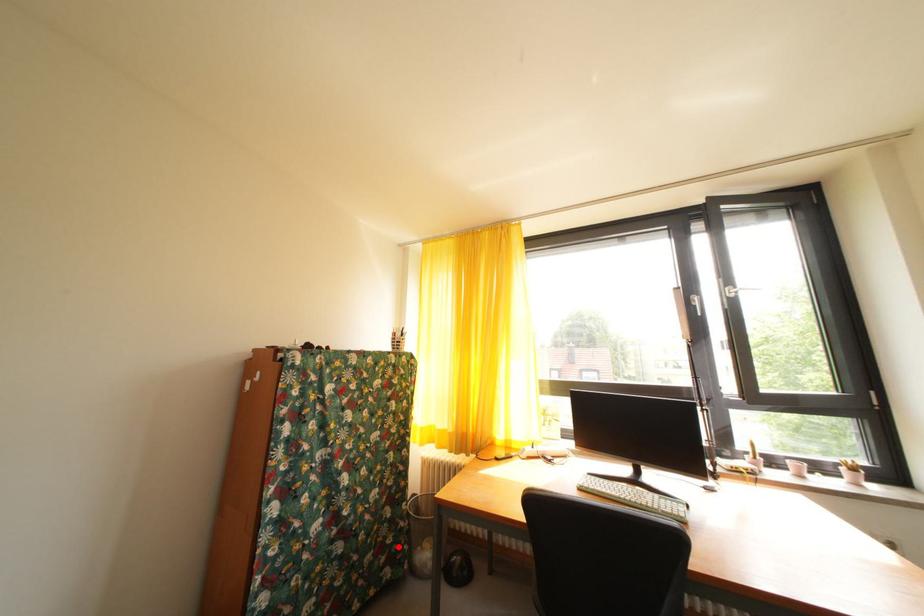
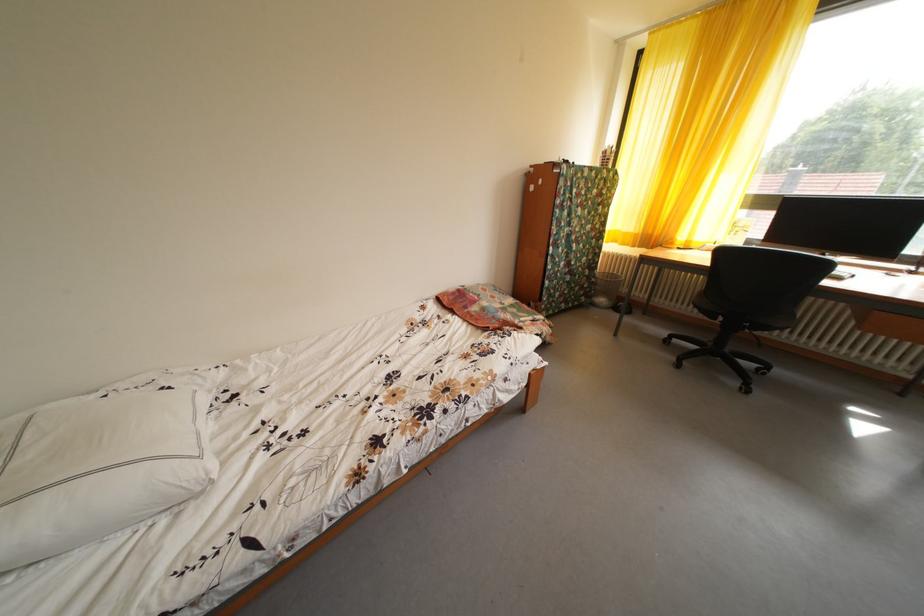
Question: I am providing you with two images of the same scene from different viewpoints. A red point is shown in image1. For the corresponding object point in image2, is it positioned nearer or farther from the camera?

Choices:
 (A) Nearer
 (B) Farther

Answer: (A)